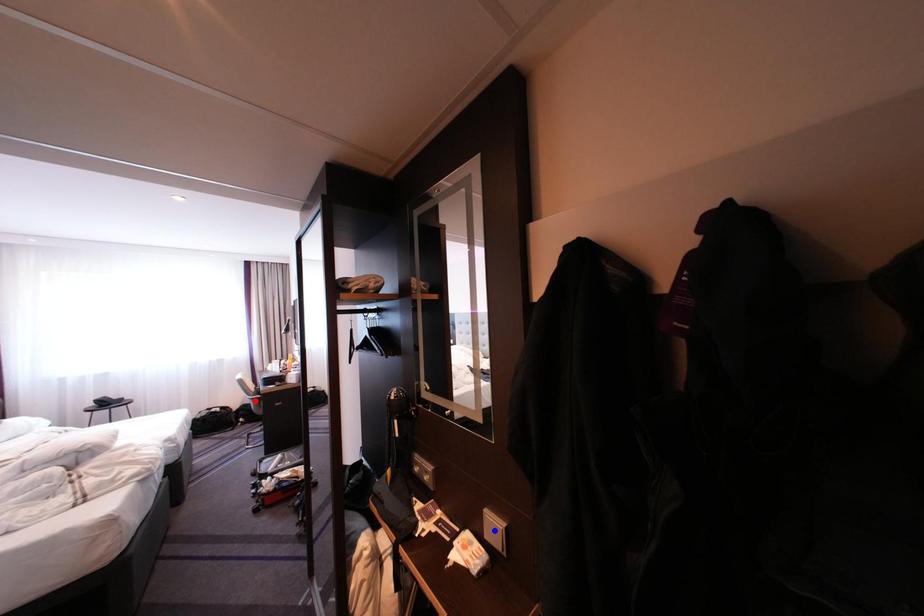
Question: Which of the two points in the image is closer to the camera?

Choices:
 (A) Blue point is closer.
 (B) Red point is closer.

Answer: (A)